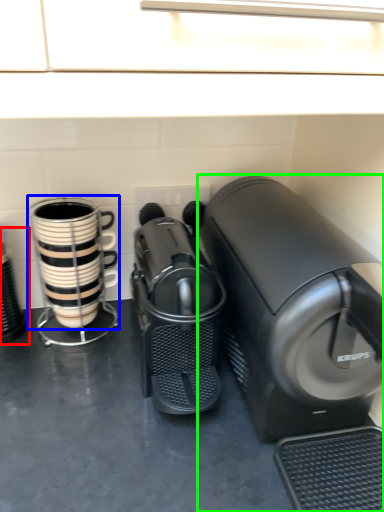
Question: Considering the real-world distances, which object is closest to appliance (highlighted by a red box)? coffee cup (highlighted by a blue box) or home appliance (highlighted by a green box).

Choices:
 (A) coffee cup
 (B) home appliance

Answer: (A)